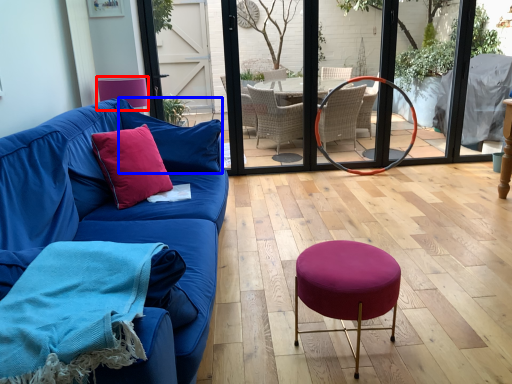
Question: Which point is closer to the camera, armchair (highlighted by a red box) or pillow (highlighted by a blue box)?

Choices:
 (A) armchair
 (B) pillow

Answer: (B)